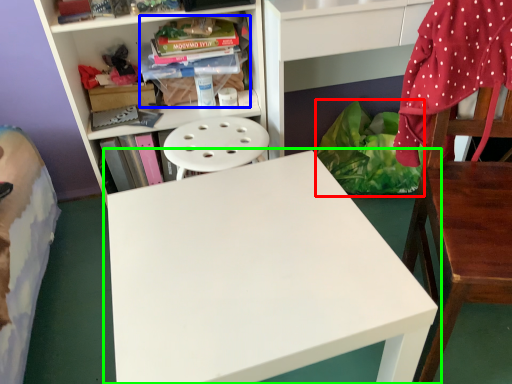
Question: Which object is positioned closest to material (highlighted by a red box)? Select from book (highlighted by a blue box) and table (highlighted by a green box).

Choices:
 (A) book
 (B) table

Answer: (A)